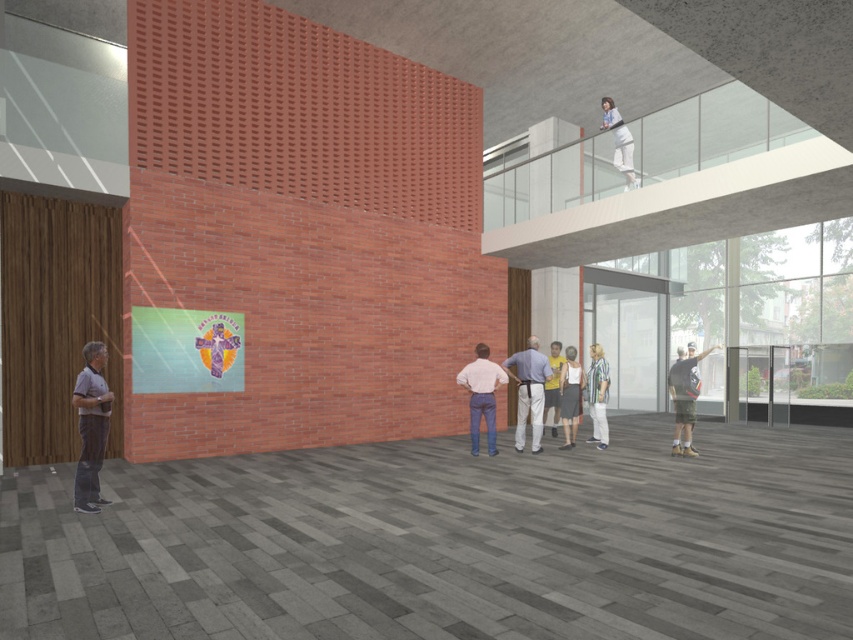
You are a fashion designer who wants to create a new collection using the white cotton pants at center and the white fabric at upper center. Which item would you choose if you need a larger piece of material for a dress design?

The white fabric at upper center is larger in size compared to the white cotton pants at center, so it would be the better choice for creating a dress design that requires a larger piece of material.